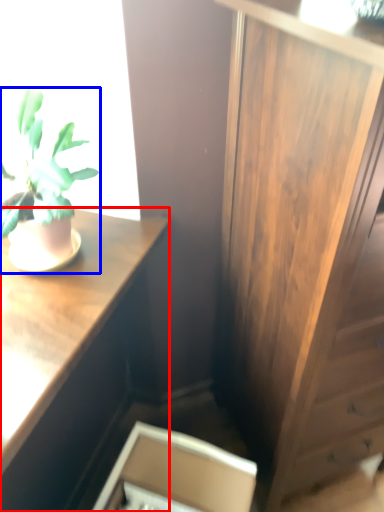
Question: Which of the following is the farthest to the observer, desk (highlighted by a red box) or houseplant (highlighted by a blue box)?

Choices:
 (A) desk
 (B) houseplant

Answer: (A)